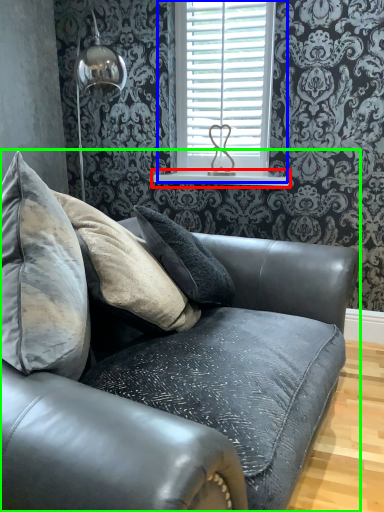
Question: Which object is positioned farthest from window sill (highlighted by a red box)? Select from window (highlighted by a blue box) and studio couch (highlighted by a green box).

Choices:
 (A) window
 (B) studio couch

Answer: (B)